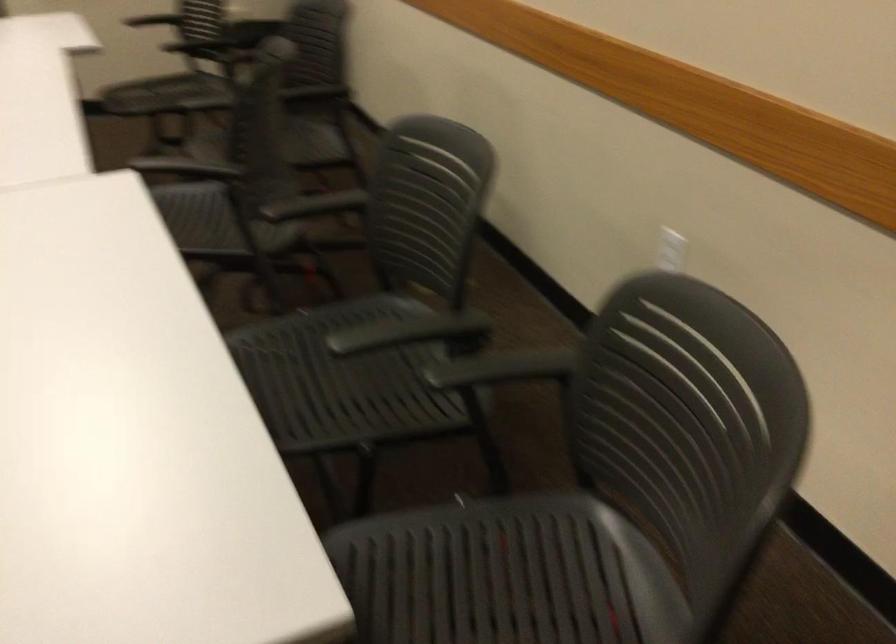
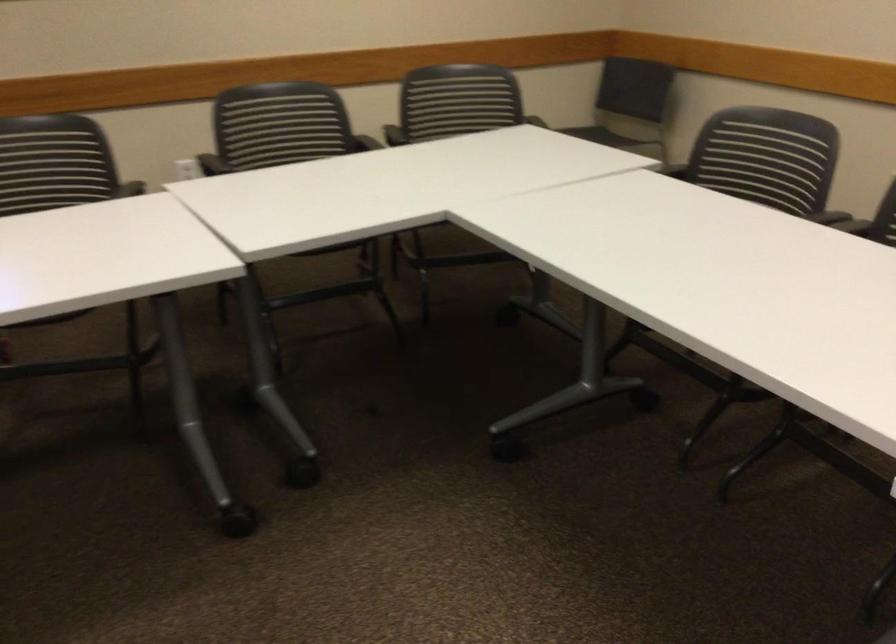
Locate, in the second image, the point that corresponds to point (746, 465) in the first image.

(455, 100)